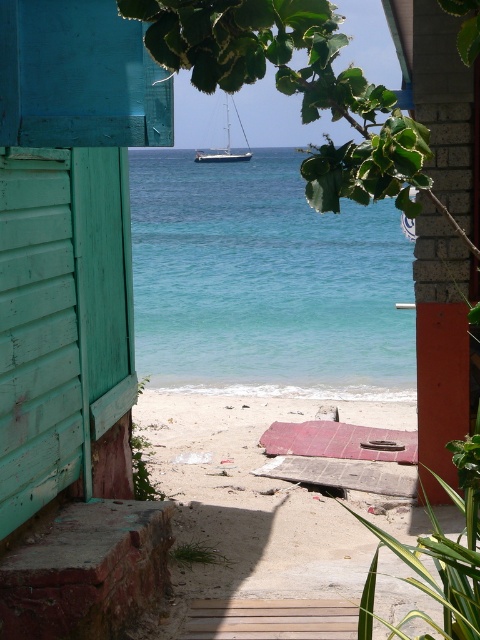
Question: Can you confirm if teal wood shutter at left is thinner than brick wall at right?

Choices:
 (A) no
 (B) yes

Answer: (B)

Question: Which point is farther from the camera taking this photo?

Choices:
 (A) (80, 132)
 (B) (261, 221)
 (C) (72, 333)
 (D) (465, 182)

Answer: (B)

Question: Is teal wood shutter at left below brick wall at right?

Choices:
 (A) yes
 (B) no

Answer: (A)

Question: Which object is positioned closest to the teal wooden beach hut at left?

Choices:
 (A) wooden boardwalk at lower center
 (B) teal wood shutter at left
 (C) white glossy sailboat at center
 (D) brick wall at right

Answer: (B)

Question: Is teal wooden beach hut at left wider than wooden boardwalk at lower center?

Choices:
 (A) no
 (B) yes

Answer: (A)

Question: Estimate the real-world distances between objects in this image. Which object is closer to the brick wall at right?

Choices:
 (A) white glossy sailboat at center
 (B) teal wood shutter at left

Answer: (B)